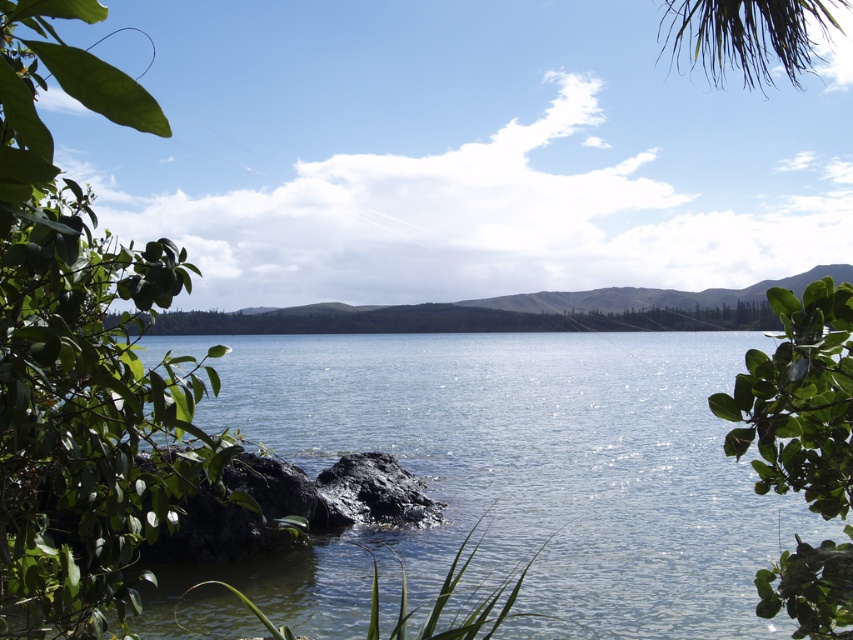
You are standing in the serene landscape and want to take a photo that includes both the green leafy tree at left and the green leafy tree at center. Which tree should you position closer to the edge of your camera frame to ensure both are fully visible?

You should position the green leafy tree at left closer to the edge of your camera frame because it has a larger size compared to the green leafy tree at center, allowing both to fit within the frame.

You are standing in a natural landscape with a clear water body and a green leafy tree. You want to take a photo where the clear water at center is positioned to the right of the green leafy tree at left. Based on the scene description, is this possible?

Yes, the clear water at center is already positioned to the right of the green leafy tree at left as described in the scene.